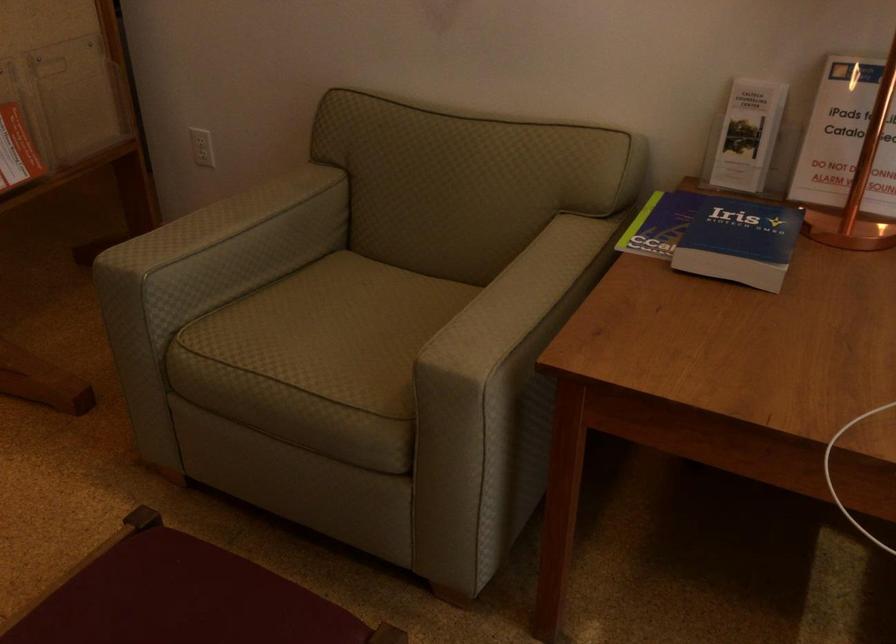
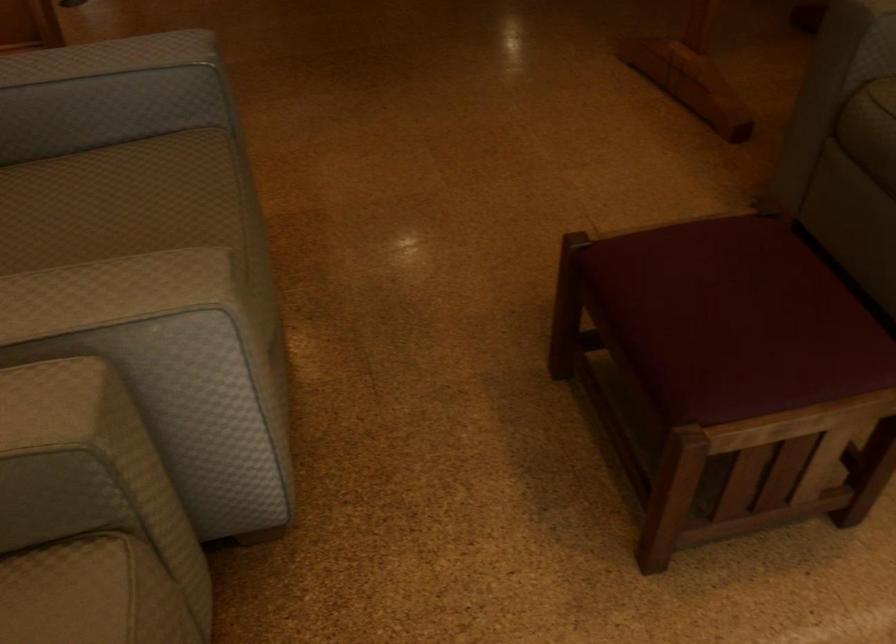
In the scene shown: Based on the continuous images, in which direction is the camera rotating?

The camera's rotation is toward left-down.